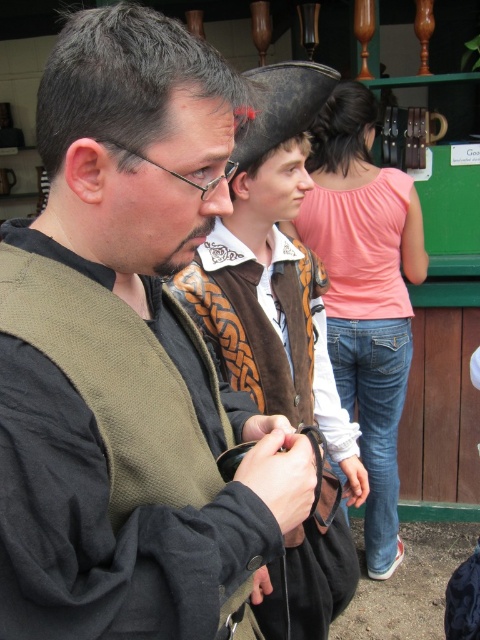
Which is more to the right, matte brown vest at center or shiny black leather cowboy hat at center?

shiny black leather cowboy hat at center

Can you confirm if matte brown vest at center is wider than shiny black leather cowboy hat at center?

Correct, the width of matte brown vest at center exceeds that of shiny black leather cowboy hat at center.

Between point (23, 257) and point (264, 116), which one is positioned in front?

Point (23, 257)

The width and height of the screenshot is (480, 640). I want to click on matte brown vest at center, so coord(130,358).

Can you confirm if matte brown vest at center is smaller than pink cotton shirt at upper center?

Correct, matte brown vest at center occupies less space than pink cotton shirt at upper center.

Is matte brown vest at center below pink cotton shirt at upper center?

Indeed, matte brown vest at center is positioned under pink cotton shirt at upper center.

Find the location of a particular element. Image resolution: width=480 pixels, height=640 pixels. matte brown vest at center is located at coordinates (130, 358).

Does pink cotton shirt at upper center appear on the left side of shiny black leather cowboy hat at center?

In fact, pink cotton shirt at upper center is to the right of shiny black leather cowboy hat at center.

Which of these two, pink cotton shirt at upper center or shiny black leather cowboy hat at center, stands taller?

With more height is pink cotton shirt at upper center.

The width and height of the screenshot is (480, 640). Identify the location of pink cotton shirt at upper center. (364, 292).